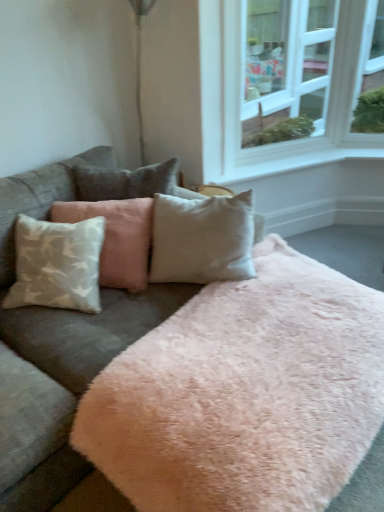
Find the location of `empty space that is ontop of white smooth window sill at center (from a real-world perspective)`. empty space that is ontop of white smooth window sill at center (from a real-world perspective) is located at coordinates 254,164.